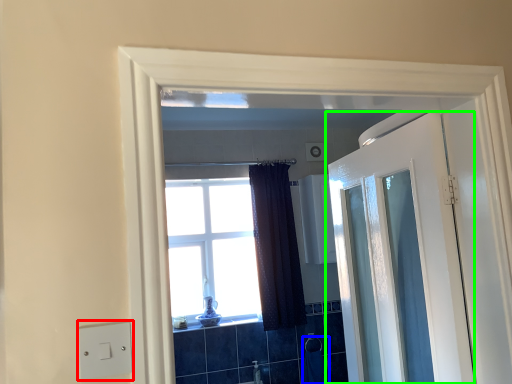
Question: Which is nearer to the light switch (highlighted by a red box)? laundry (highlighted by a blue box) or door (highlighted by a green box).

Choices:
 (A) laundry
 (B) door

Answer: (B)